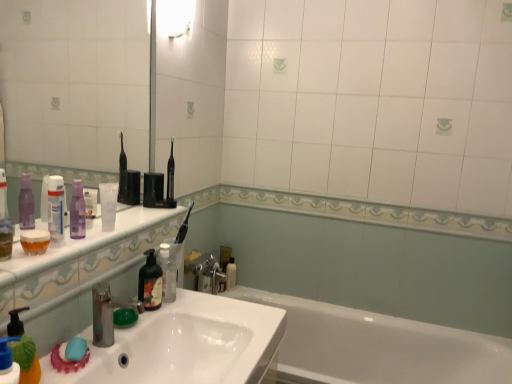
The image size is (512, 384). I want to click on vacant space that's between black plastic toothbrush at upper center and purple matte bottle at left, the fourth toiletry positioned from the bottom, so click(132, 221).